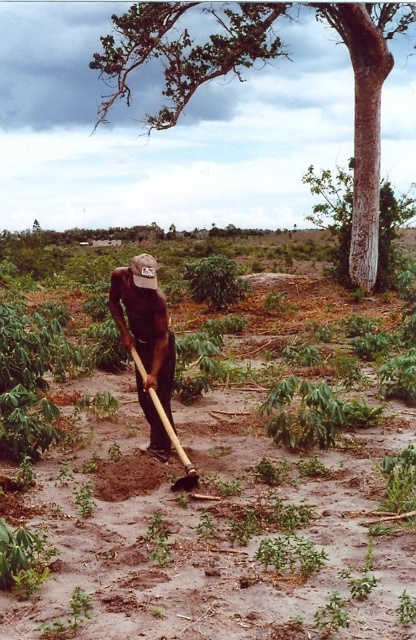
Does dark skin wood hoe at center have a greater height compared to wooden shovel at center?

Indeed, dark skin wood hoe at center has a greater height compared to wooden shovel at center.

Does dark skin wood hoe at center have a lesser height compared to wooden shovel at center?

No.

You are a GUI agent. You are given a task and a screenshot of the screen. Output one action in this format:
    pyautogui.click(x=<x>, y=<y>)
    Task: Click on the dark skin wood hoe at center
    The width and height of the screenshot is (416, 640).
    Given the screenshot: What is the action you would take?
    pyautogui.click(x=146, y=339)

Which of these two, smooth bark tree at upper center or dark skin wood hoe at center, stands shorter?

With less height is dark skin wood hoe at center.

Does point (379, 113) lie behind point (156, 448)?

Yes, point (379, 113) is farther from viewer.

The image size is (416, 640). Find the location of `smooth bark tree at upper center`. smooth bark tree at upper center is located at coordinates (264, 61).

Which is more to the left, smooth bark tree at upper center or wooden shovel at center?

wooden shovel at center is more to the left.

Who is higher up, smooth bark tree at upper center or wooden shovel at center?

smooth bark tree at upper center is higher up.

What do you see at coordinates (264, 61) in the screenshot? I see `smooth bark tree at upper center` at bounding box center [264, 61].

At what (x,y) coordinates should I click in order to perform the action: click on smooth bark tree at upper center. Please return your answer as a coordinate pair (x, y). The width and height of the screenshot is (416, 640). Looking at the image, I should click on (264, 61).